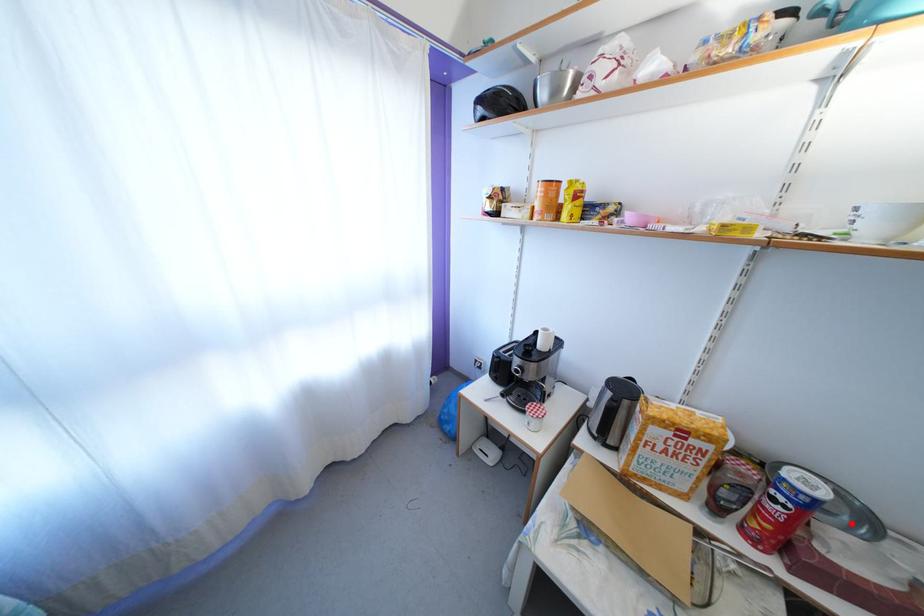
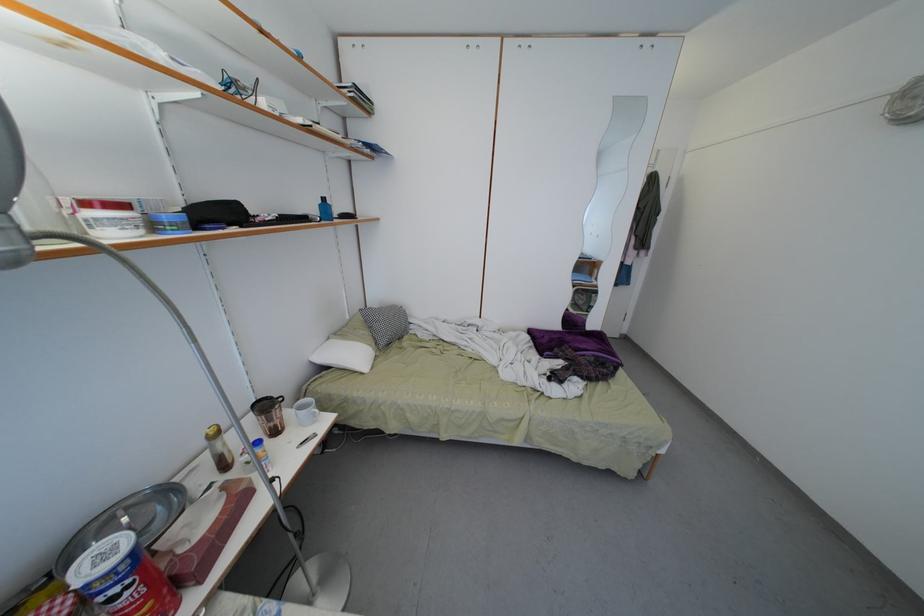
Question: I am providing you with two images of the same scene from different viewpoints. A red point is shown in image1. For the corresponding object point in image2, is it positioned nearer or farther from the camera?

Choices:
 (A) Nearer
 (B) Farther

Answer: (B)